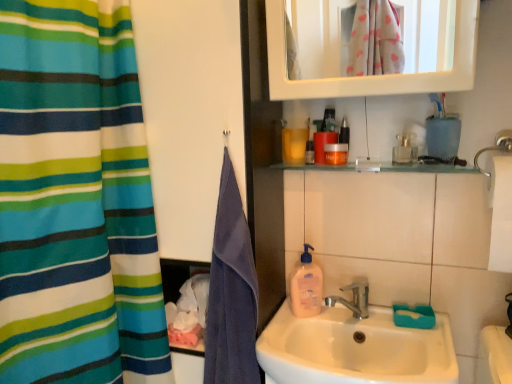
You are a GUI agent. You are given a task and a screenshot of the screen. Output one action in this format:
    pyautogui.click(x=<x>, y=<y>)
    Task: Click on the orange matte jar at upper center, which is the 3th mouthwash in right-to-left order
    
    Given the screenshot: What is the action you would take?
    pyautogui.click(x=336, y=154)

At what (x,y) coordinates should I click in order to perform the action: click on translucent plastic bottle at upper center, the 1th mouthwash when ordered from left to right. Please return your answer as a coordinate pair (x, y). Looking at the image, I should click on (309, 152).

Find the location of a particular element. white ceramic sink at center is located at coordinates [355, 348].

You are a GUI agent. You are given a task and a screenshot of the screen. Output one action in this format:
    pyautogui.click(x=<x>, y=<y>)
    Task: Click on the teal plastic toothbrush holder at upper right
    This screenshot has height=384, width=512.
    Given the screenshot: What is the action you would take?
    pyautogui.click(x=443, y=136)

Find the location of a particular element. The image size is (512, 384). blue towel at left is located at coordinates coord(190,114).

Is clear glass bottle at upper right, the first mouthwash positioned from the right, at the back of translucent plastic soap dispenser at sink?

No, translucent plastic soap dispenser at sink is not facing the opposite direction of clear glass bottle at upper right, the first mouthwash positioned from the right.

Is translucent plastic soap dispenser at sink further to the viewer compared to clear glass bottle at upper right, which is counted as the 4th mouthwash, starting from the left?

Yes.

Between translucent plastic soap dispenser at sink and clear glass bottle at upper right, which is counted as the 4th mouthwash, starting from the left, which one has larger size?

translucent plastic soap dispenser at sink.

Looking at their sizes, would you say translucent plastic soap dispenser at sink is wider or thinner than clear glass bottle at upper right, which is counted as the 4th mouthwash, starting from the left?

translucent plastic soap dispenser at sink is thinner than clear glass bottle at upper right, which is counted as the 4th mouthwash, starting from the left.

From a real-world perspective, which object rests below the other?

translucent plastic bottle at upper center, the 1th mouthwash when ordered from left to right, is physically lower.

From the image's perspective, would you say translucent plastic bottle at upper center, the fourth mouthwash from the right, is shown under orange matte bottle at upper center, arranged as the third mouthwash when viewed from the left?

Indeed, from the image's perspective, translucent plastic bottle at upper center, the fourth mouthwash from the right, is shown beneath orange matte bottle at upper center, arranged as the third mouthwash when viewed from the left.

Is translucent plastic bottle at upper center, the fourth mouthwash from the right, far away from orange matte bottle at upper center, arranged as the third mouthwash when viewed from the left?

translucent plastic bottle at upper center, the fourth mouthwash from the right, is actually quite close to orange matte bottle at upper center, arranged as the third mouthwash when viewed from the left.

Can you confirm if clear glass bottle at upper right, the first mouthwash positioned from the right, is positioned to the left of teal plastic toothbrush holder at upper right?

Indeed, clear glass bottle at upper right, the first mouthwash positioned from the right, is positioned on the left side of teal plastic toothbrush holder at upper right.

Which is less distant, (409, 153) or (456, 136)?

The point (456, 136) is closer to the camera.

Is clear glass bottle at upper right, which is counted as the 4th mouthwash, starting from the left, oriented towards blue towel at left?

No.

Is point (404, 142) positioned behind point (180, 221)?

Yes.

Would you say clear glass bottle at upper right, which is counted as the 4th mouthwash, starting from the left, contains blue towel at left?

No, clear glass bottle at upper right, which is counted as the 4th mouthwash, starting from the left, does not contain blue towel at left.

From a real-world perspective, is clear glass bottle at upper right, the first mouthwash positioned from the right, above or below blue towel at left?

In terms of real-world spatial position, clear glass bottle at upper right, the first mouthwash positioned from the right, is above blue towel at left.

Consider the image. Can you confirm if striped fabric curtain at left is bigger than purple cotton towel at left?

Indeed, striped fabric curtain at left has a larger size compared to purple cotton towel at left.

Does point (141, 342) come closer to viewer compared to point (241, 260)?

No, (141, 342) is further to viewer.

Visually, is striped fabric curtain at left positioned to the left or to the right of purple cotton towel at left?

From the image, it's evident that striped fabric curtain at left is to the left of purple cotton towel at left.

From a real-world perspective, which object stands above the other?

In real-world perspective, striped fabric curtain at left is above.

From the image's perspective, is clear glass bottle at upper right, which is counted as the 4th mouthwash, starting from the left, below striped fabric curtain at left?

Incorrect, from the image's perspective, clear glass bottle at upper right, which is counted as the 4th mouthwash, starting from the left, is higher than striped fabric curtain at left.

Can you confirm if clear glass bottle at upper right, which is counted as the 4th mouthwash, starting from the left, is positioned to the right of striped fabric curtain at left?

Yes.

Which of these two, clear glass bottle at upper right, the first mouthwash positioned from the right, or striped fabric curtain at left, stands shorter?

Standing shorter between the two is clear glass bottle at upper right, the first mouthwash positioned from the right.

From the picture: Would you say striped fabric curtain at left is part of clear glass bottle at upper right, the first mouthwash positioned from the right,'s contents?

No, clear glass bottle at upper right, the first mouthwash positioned from the right, does not contain striped fabric curtain at left.

Which is nearer, (x=115, y=247) or (x=415, y=135)?

Point (x=115, y=247) is closer to the camera than point (x=415, y=135).

Is there a large distance between striped fabric curtain at left and clear glass bottle at upper right, which is counted as the 4th mouthwash, starting from the left?

That's not correct — striped fabric curtain at left is a little close to clear glass bottle at upper right, which is counted as the 4th mouthwash, starting from the left.

Is striped fabric curtain at left at the left side of clear glass bottle at upper right, the first mouthwash positioned from the right?

Correct, you'll find striped fabric curtain at left to the left of clear glass bottle at upper right, the first mouthwash positioned from the right.

Identify the location of cleaning product behind the clear glass bottle at upper right, which is counted as the 4th mouthwash, starting from the left. (306, 286).

The image size is (512, 384). What are the coordinates of `the 2nd mouthwash to the right when counting from the translucent plastic bottle at upper center, the 1th mouthwash when ordered from left to right` in the screenshot? It's located at (344, 131).

From the image, which object appears to be nearer to clear glass bottle at upper right, which is counted as the 4th mouthwash, starting from the left, teal plastic toothbrush holder at upper right or orange matte bottle at upper center, which appears as the 2th mouthwash when viewed from the right?

teal plastic toothbrush holder at upper right is closer to clear glass bottle at upper right, which is counted as the 4th mouthwash, starting from the left.

Considering their positions, is translucent plastic soap dispenser at sink positioned further to teal plastic toothbrush holder at upper right than translucent plastic bottle at upper center, the 1th mouthwash when ordered from left to right?

translucent plastic soap dispenser at sink is positioned further to the anchor teal plastic toothbrush holder at upper right.

Which object lies nearer to the anchor point orange matte bottle at upper center, arranged as the third mouthwash when viewed from the left, clear glass bottle at upper right, which is counted as the 4th mouthwash, starting from the left, or purple cotton towel at left?

Among the two, clear glass bottle at upper right, which is counted as the 4th mouthwash, starting from the left, is located nearer to orange matte bottle at upper center, arranged as the third mouthwash when viewed from the left.

Estimate the real-world distances between objects in this image. Which object is closer to striped fabric curtain at left, clear glass bottle at upper right, the first mouthwash positioned from the right, or white ceramic sink at center?

white ceramic sink at center.

Which object lies further to the anchor point clear glass bottle at upper right, the first mouthwash positioned from the right, blue towel at left or translucent plastic soap dispenser at sink?

blue towel at left is further to clear glass bottle at upper right, the first mouthwash positioned from the right.

From the image, which object appears to be nearer to clear glass bottle at upper right, which is counted as the 4th mouthwash, starting from the left, orange matte bottle at upper center, which appears as the 2th mouthwash when viewed from the right, or striped fabric curtain at left?

The object closer to clear glass bottle at upper right, which is counted as the 4th mouthwash, starting from the left, is orange matte bottle at upper center, which appears as the 2th mouthwash when viewed from the right.

Considering their positions, is orange matte bottle at upper center, arranged as the third mouthwash when viewed from the left, positioned closer to striped fabric curtain at left than white ceramic sink at center?

white ceramic sink at center.

When comparing their distances from white ceramic sink at center, does translucent plastic bottle at upper center, the 1th mouthwash when ordered from left to right, or translucent plastic soap dispenser at sink seem further?

Based on the image, translucent plastic bottle at upper center, the 1th mouthwash when ordered from left to right, appears to be further to white ceramic sink at center.

Identify the location of cleaning product between purple cotton towel at left and white ceramic sink at center from left to right. The width and height of the screenshot is (512, 384). (306, 286).

Where is `cleaning product situated between striped fabric curtain at left and clear glass bottle at upper right, which is counted as the 4th mouthwash, starting from the left, from left to right`? cleaning product situated between striped fabric curtain at left and clear glass bottle at upper right, which is counted as the 4th mouthwash, starting from the left, from left to right is located at coordinates (306, 286).

You are a GUI agent. You are given a task and a screenshot of the screen. Output one action in this format:
    pyautogui.click(x=<x>, y=<y>)
    Task: Click on the cleaning product between translucent plastic bottle at upper center, the 1th mouthwash when ordered from left to right, and white ceramic sink at center vertically
    
    Given the screenshot: What is the action you would take?
    pyautogui.click(x=306, y=286)

The width and height of the screenshot is (512, 384). In order to click on screen door located between striped fabric curtain at left and clear glass bottle at upper right, the first mouthwash positioned from the right, in the left-right direction in this screenshot , I will do `click(190, 114)`.